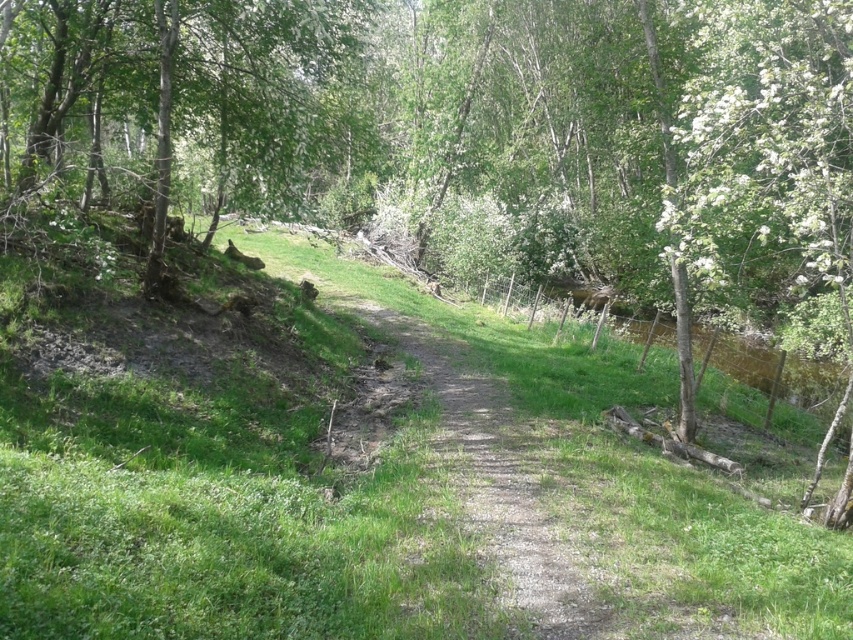
Based on the photo, you are standing at the starting point of the dirt path. You want to walk to the green grassy at center. Which direction should you walk?

You should walk forward along the dirt path towards the green grassy at center, which is located at point (346, 474) in the scene.

You are a hiker walking along the dirt path and looking at the scene. Which object is positioned lower in the image, the green grassy at center or the green leafy tree at upper left?

The green grassy at center is positioned below the green leafy tree at upper left, so the green grassy at center is lower in the image.